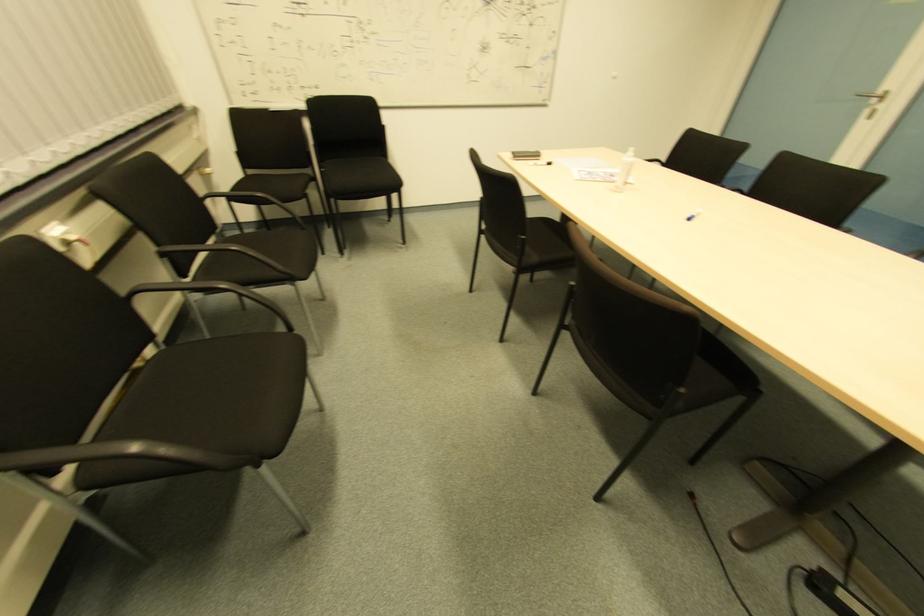
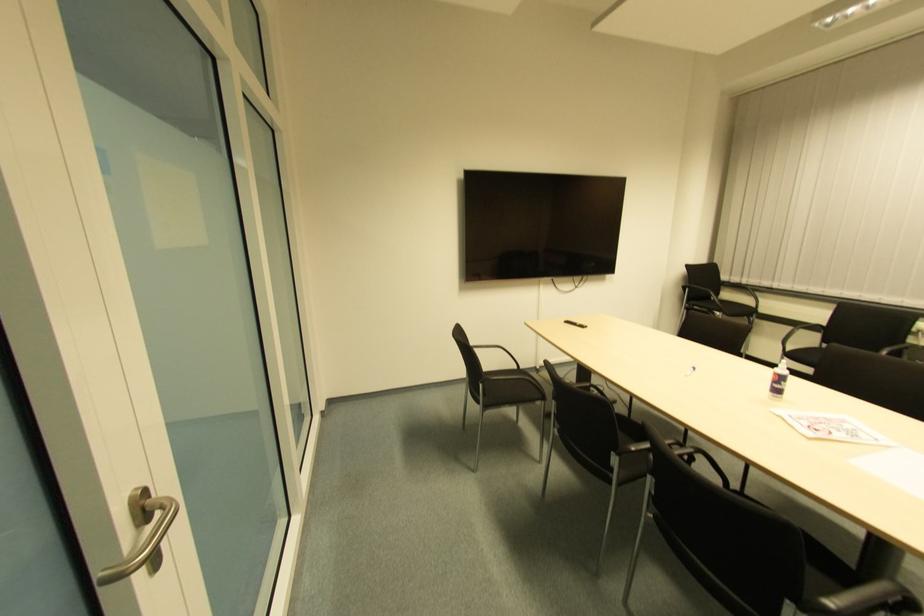
The point at (688, 222) is marked in the first image. Where is the corresponding point in the second image?

(691, 371)